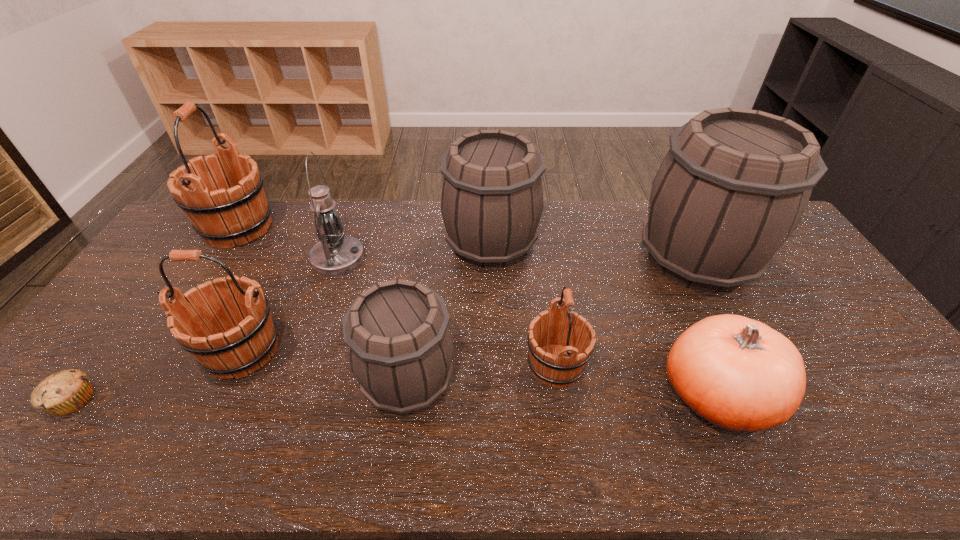
The width and height of the screenshot is (960, 540). I want to click on wine bucket present at the left edge, so click(237, 212).

Identify the location of muffin at the left edge. The width and height of the screenshot is (960, 540). (62, 393).

What are the coordinates of `object at the right edge` in the screenshot? It's located at (733, 187).

The image size is (960, 540). In order to click on object at the far left corner in this screenshot , I will do `click(237, 212)`.

Identify the location of object that is at the far right corner. (733, 187).

At what (x,y) coordinates should I click in order to perform the action: click on vacant position at the far edge of the desktop. Please return your answer as a coordinate pair (x, y). Looking at the image, I should click on (305, 221).

In the image, there is a desktop. Identify the location of vacant region at the near edge. This screenshot has width=960, height=540. (207, 438).

This screenshot has width=960, height=540. I want to click on vacant space at the left edge of the desktop, so click(x=159, y=289).

The width and height of the screenshot is (960, 540). I want to click on vacant space at the right edge of the desktop, so click(x=807, y=262).

Identify the location of free space at the near right corner. The image size is (960, 540). [x=931, y=468].